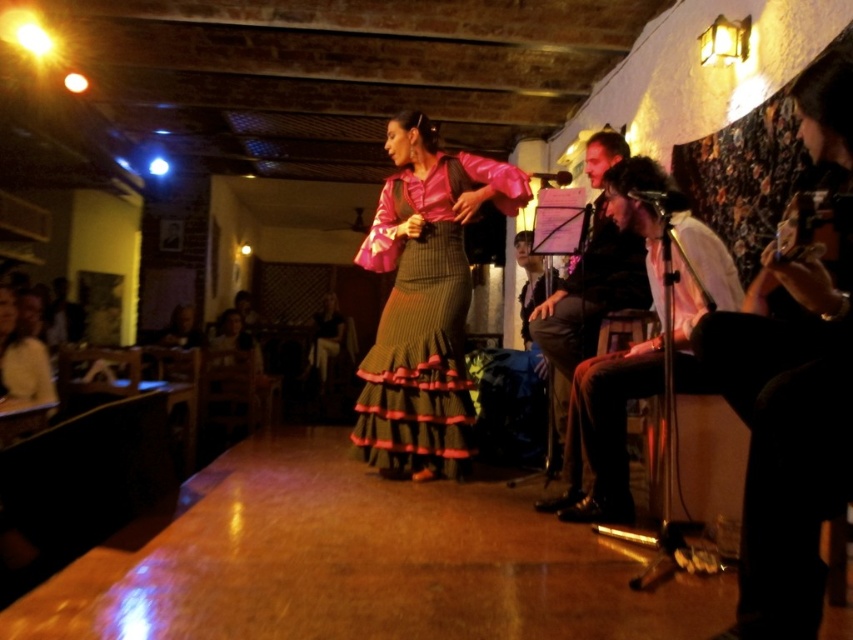
Question: Which object is the farthest from the white shirt at right?

Choices:
 (A) matte white shirt at left
 (B) shiny black guitar at right

Answer: (A)

Question: Among these points, which one is farthest from the camera?

Choices:
 (A) (375, 390)
 (B) (517, 298)

Answer: (B)

Question: Which object is positioned closest to the smooth black jacket at center?

Choices:
 (A) dark brown leather jacket at upper right
 (B) pink satin dress at center

Answer: (A)

Question: Is dark brown leather jacket at upper right below matte white shirt at left?

Choices:
 (A) yes
 (B) no

Answer: (B)

Question: Is matte white shirt at left bigger than smooth black jacket at center?

Choices:
 (A) yes
 (B) no

Answer: (A)

Question: Does shiny black guitar at right have a lesser width compared to white shirt at right?

Choices:
 (A) yes
 (B) no

Answer: (A)